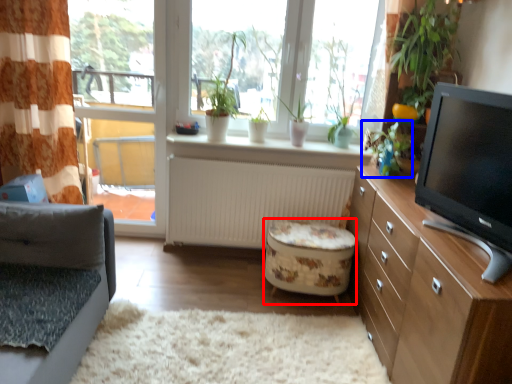
Question: Among these objects, which one is nearest to the camera, stool (highlighted by a red box) or plant (highlighted by a blue box)?

Choices:
 (A) stool
 (B) plant

Answer: (B)